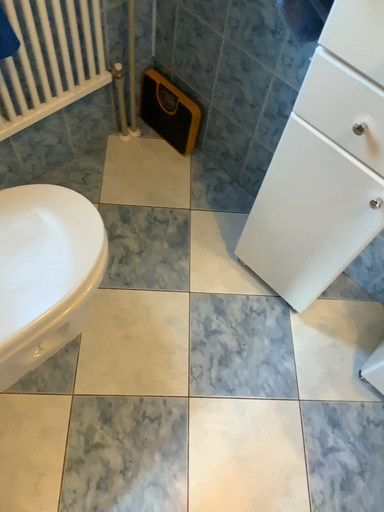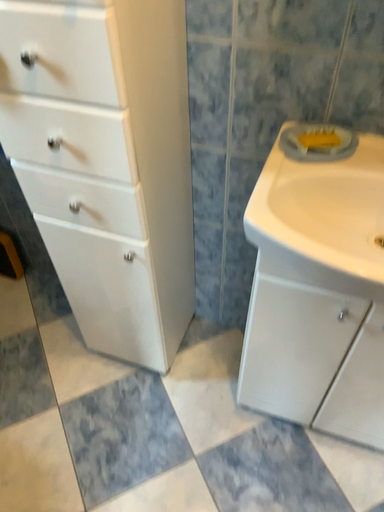
Question: How did the camera likely rotate when shooting the video?

Choices:
 (A) rotated upward
 (B) rotated downward

Answer: (A)